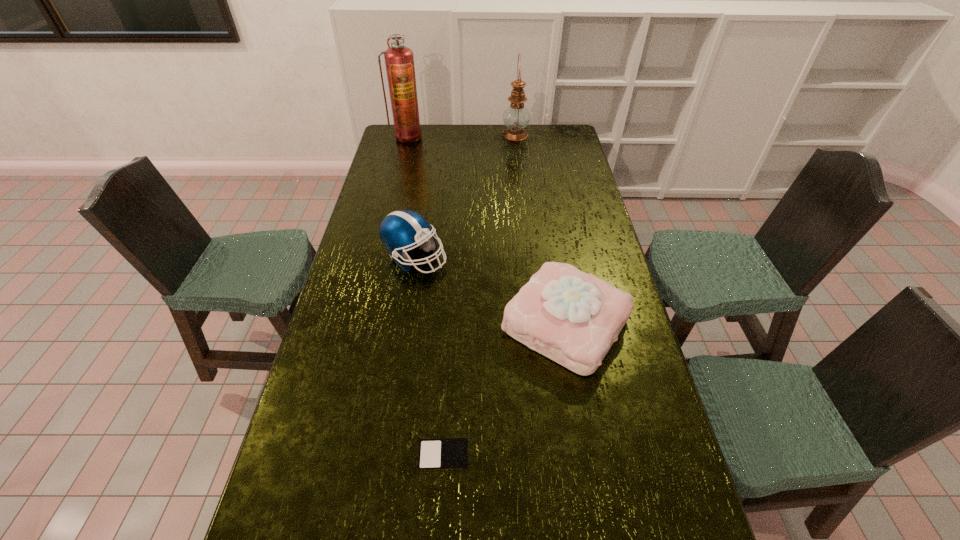
This screenshot has width=960, height=540. Identify the location of the tallest object. (399, 61).

Locate an element on the screen. The height and width of the screenshot is (540, 960). oil lamp is located at coordinates (516, 117).

I want to click on the third shortest object, so 400,230.

Identify the location of cake. (571, 317).

Identify the location of the nearest object. The width and height of the screenshot is (960, 540). (434, 454).

The height and width of the screenshot is (540, 960). Find the location of `the shortest object`. the shortest object is located at coordinates (434, 454).

Where is `vacant space located 0.230m on the side of the fire extinguisher with the label`? This screenshot has width=960, height=540. vacant space located 0.230m on the side of the fire extinguisher with the label is located at coordinates (398, 170).

Find the location of a particular element. free space located 0.370m on the front of the fourth shortest object is located at coordinates (521, 188).

Where is `free region located 0.180m at the front of the football helmet with the faceguard`? Image resolution: width=960 pixels, height=540 pixels. free region located 0.180m at the front of the football helmet with the faceguard is located at coordinates (498, 258).

This screenshot has width=960, height=540. In order to click on vacant space situated 0.330m on the left of the cake in this screenshot , I will do `click(393, 324)`.